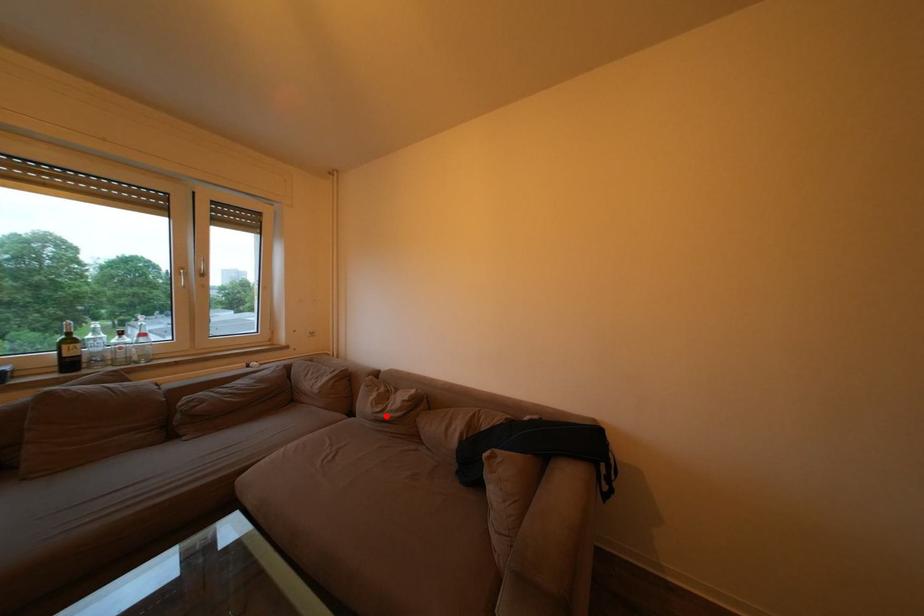
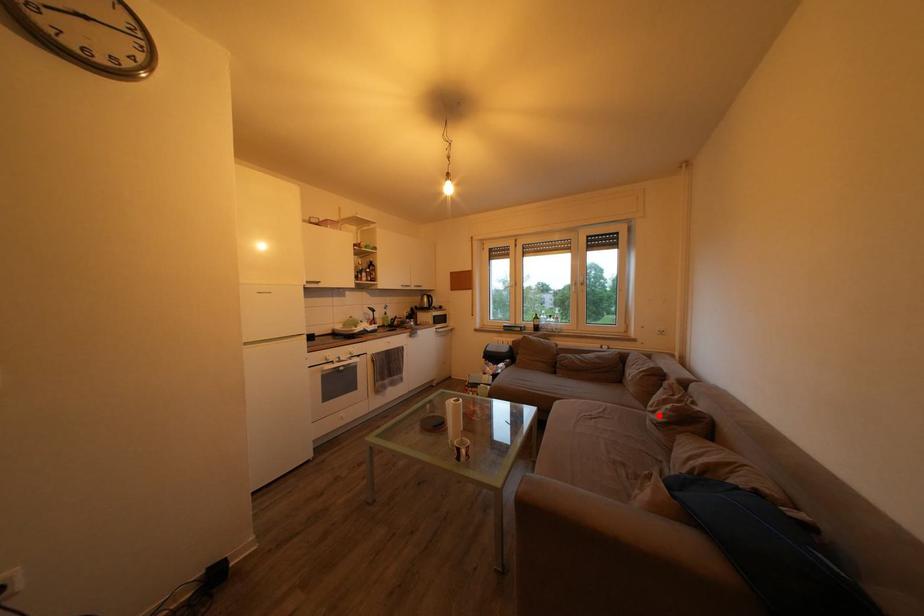
I am providing you with two images of the same scene from different viewpoints. A red point is marked on the first image and another point is marked on the second image. Does the point marked in image1 correspond to the same location as the one in image2?

Yes